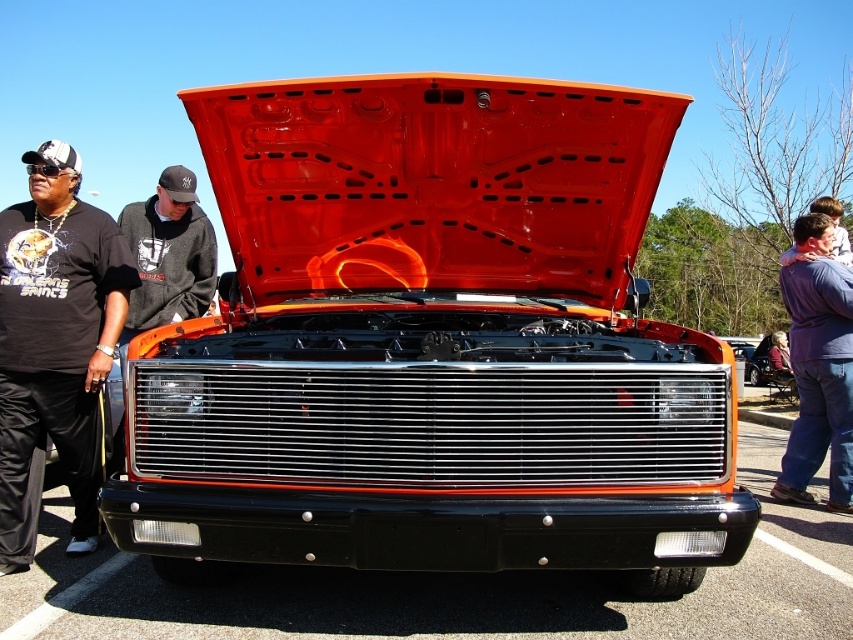
Does black fabric shirt at left have a smaller size compared to blue denim jeans at right?

Indeed, black fabric shirt at left has a smaller size compared to blue denim jeans at right.

Which is behind, point (88, 458) or point (801, 317)?

Point (801, 317)

The width and height of the screenshot is (853, 640). What are the coordinates of `black fabric shirt at left` in the screenshot? It's located at (55, 344).

Is shiny chrome grille at center behind blue denim jeans at right?

No, shiny chrome grille at center is closer to the viewer.

The image size is (853, 640). Find the location of `shiny chrome grille at center`. shiny chrome grille at center is located at coordinates (432, 344).

Who is more distant from viewer, (462, 248) or (815, 396)?

The point (815, 396) is behind.

Where is `shiny chrome grille at center`? Image resolution: width=853 pixels, height=640 pixels. shiny chrome grille at center is located at coordinates (432, 344).

Does black plastic bumper at center appear on the right side of black fabric shirt at left?

Yes, black plastic bumper at center is to the right of black fabric shirt at left.

In the scene shown: Between black plastic bumper at center and black fabric shirt at left, which one has more height?

With more height is black fabric shirt at left.

This screenshot has width=853, height=640. What do you see at coordinates (450, 589) in the screenshot?
I see `black plastic bumper at center` at bounding box center [450, 589].

Identify the location of black plastic bumper at center. This screenshot has height=640, width=853. (450, 589).